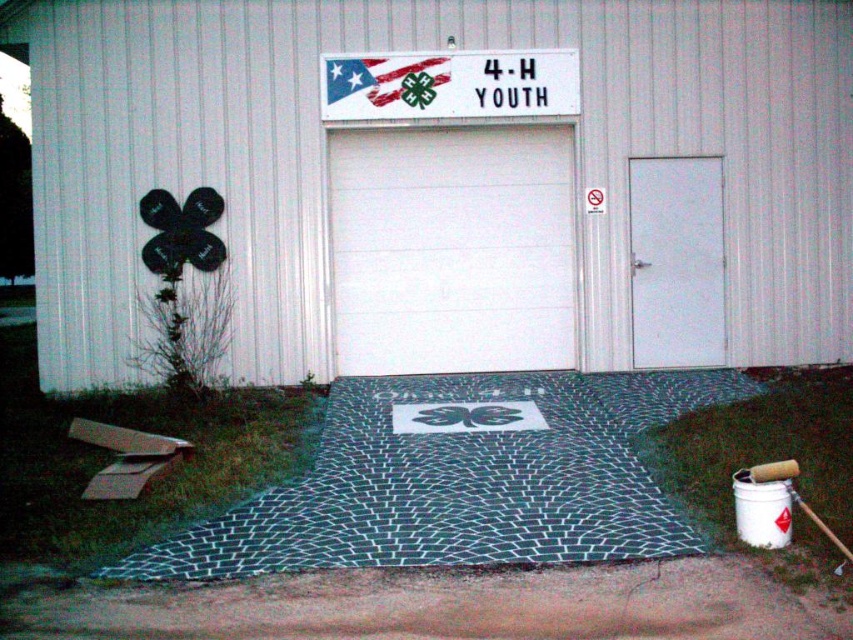
You are standing in front of the building and want to enter the garage. Which object at the coordinates point [451,248] should you approach to enter the garage?

The point [451,248] corresponds to the white smooth garage door at center, so you should approach the white smooth garage door at center to enter the garage.

You are a visitor arriving at the 4H Youth building and need to enter through the garage door. You see the white matte garage door at center and the white paper sign at upper center. Which object is located above the other?

The white paper sign at upper center is located above the white matte garage door at center.

You are a visitor arriving at the building and need to enter through the entrance. You see the white matte garage door at center and the white paper sign at upper center. Which one is closer to you as you approach the building?

The white matte garage door at center is closer to you because the white paper sign at upper center is behind it.